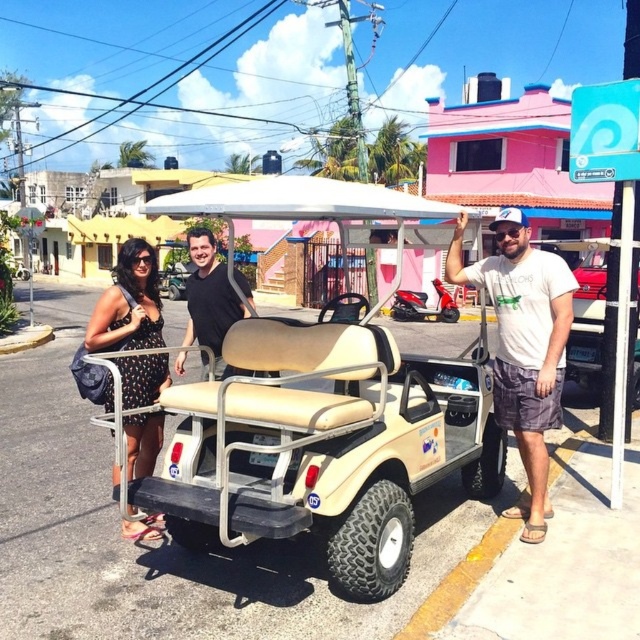
Question: Which point is closer to the camera taking this photo?

Choices:
 (A) (545, 371)
 (B) (138, 429)
 (C) (365, 592)
 (D) (204, 356)

Answer: (C)

Question: Is beige fabric golf cart at center above black dotted dress at left?

Choices:
 (A) yes
 (B) no

Answer: (A)

Question: Considering the relative positions of beige fabric golf cart at center and black dotted dress at left in the image provided, where is beige fabric golf cart at center located with respect to black dotted dress at left?

Choices:
 (A) above
 (B) below

Answer: (A)

Question: Can you confirm if beige fabric golf cart at center is positioned above black dotted dress at left?

Choices:
 (A) yes
 (B) no

Answer: (A)

Question: Estimate the real-world distances between objects in this image. Which object is closer to the black matte shirt at center?

Choices:
 (A) black dotted dress at left
 (B) white cotton t-shirt at center

Answer: (A)

Question: Among these points, which one is nearest to the camera?

Choices:
 (A) (138, 280)
 (B) (477, 392)
 (C) (224, 307)
 (D) (540, 531)

Answer: (A)